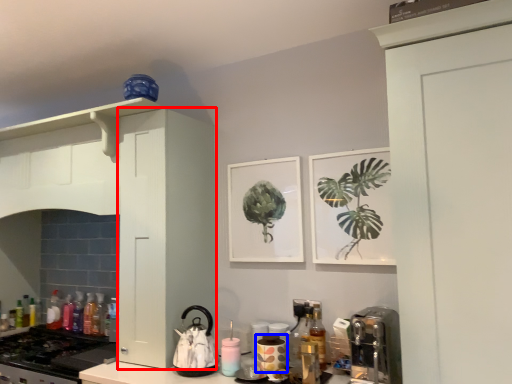
Question: Which object appears closest to the camera in this image, cabinetry (highlighted by a red box) or appliance (highlighted by a blue box)?

Choices:
 (A) cabinetry
 (B) appliance

Answer: (B)